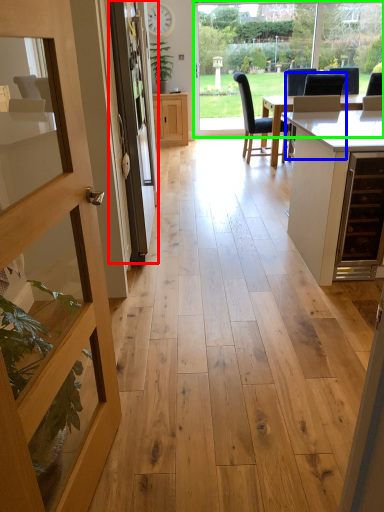
Question: Which object is the closest to the screen door (highlighted by a red box)? Choose among these: chair (highlighted by a blue box) or window frame (highlighted by a green box).

Choices:
 (A) chair
 (B) window frame

Answer: (A)